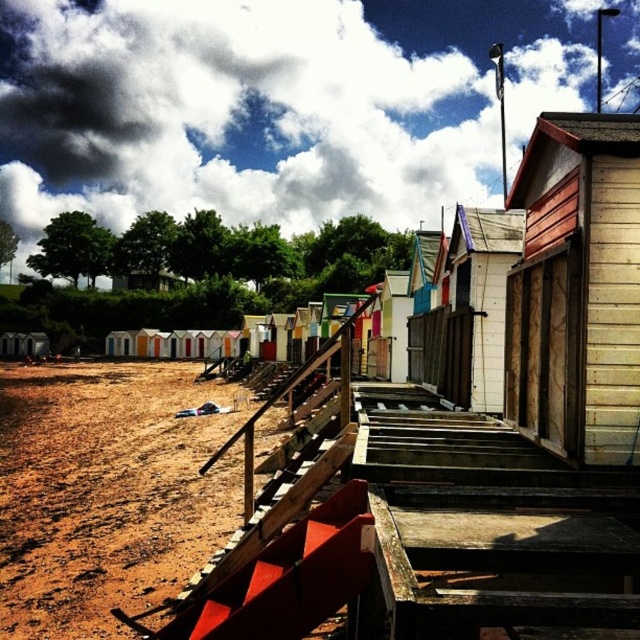
Question: Can you confirm if brown sandy dirt at lower left is positioned above wooden cabin at right?

Choices:
 (A) yes
 (B) no

Answer: (B)

Question: Which point appears closest to the camera in this image?

Choices:
 (A) (58, 554)
 (B) (620, 260)

Answer: (B)

Question: Can you confirm if brown sandy dirt at lower left is positioned to the left of wooden cabin at right?

Choices:
 (A) yes
 (B) no

Answer: (A)

Question: Among these objects, which one is farthest from the camera?

Choices:
 (A) wooden cabin at right
 (B) brown sandy dirt at lower left

Answer: (B)

Question: Among these points, which one is nearest to the camera?

Choices:
 (A) (595, 221)
 (B) (230, 387)

Answer: (A)

Question: Can you confirm if brown sandy dirt at lower left is positioned to the left of wooden cabin at right?

Choices:
 (A) no
 (B) yes

Answer: (B)